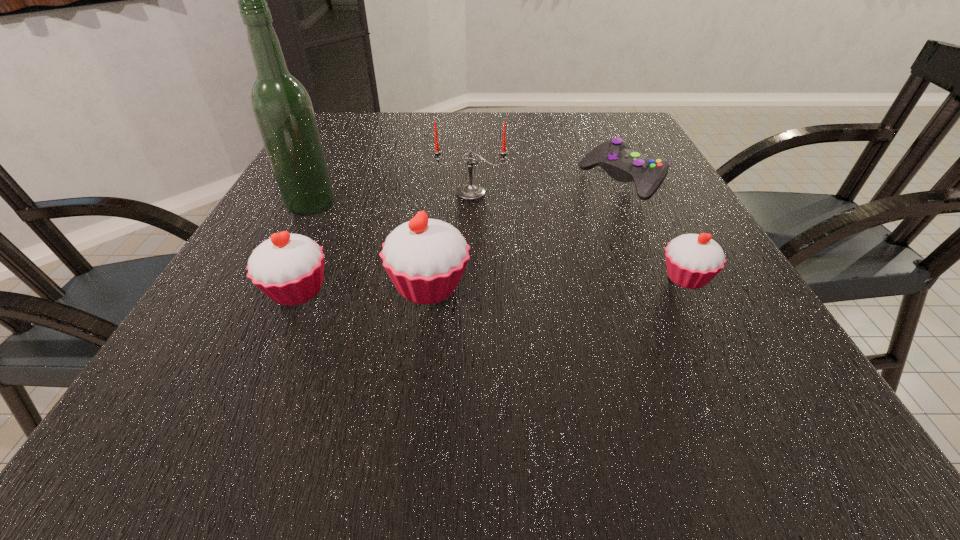
To make them evenly spaced by inserting another cupcake among them, please locate a vacant spot for this new cupcake. Please provide its 2D coordinates. Your answer should be formatted as a tuple, i.e. [(x, y)], where the tuple contains the x and y coordinates of a point satisfying the conditions above.

[(559, 282)]